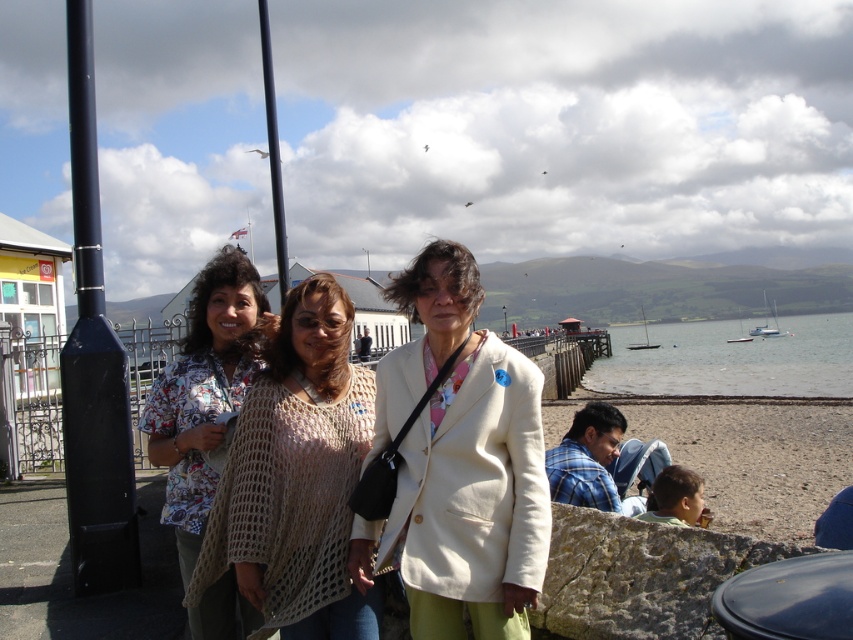
Question: Which object is farther from the camera taking this photo?

Choices:
 (A) crochet beige shawl at center
 (B) clear water at lower right
 (C) black metal pole at center

Answer: (C)

Question: Can you confirm if white woolen jacket at center is positioned below black metal pole at center?

Choices:
 (A) no
 (B) yes

Answer: (B)

Question: Which point is farther from the camera taking this photo?

Choices:
 (A) (701, 356)
 (B) (503, 307)
 (C) (276, 317)

Answer: (B)

Question: Can you confirm if smooth sand at lower right is positioned below black metal pole at upper center?

Choices:
 (A) no
 (B) yes

Answer: (B)

Question: Estimate the real-world distances between objects in this image. Which object is farther from the black metal pole at upper center?

Choices:
 (A) black metal pole at center
 (B) smooth sand at lower right
 (C) black matte pole at left
 (D) floral fabric blouse at left

Answer: (A)

Question: Considering the relative positions of clear water at lower right and black metal pole at center in the image provided, where is clear water at lower right located with respect to black metal pole at center?

Choices:
 (A) above
 (B) below

Answer: (B)